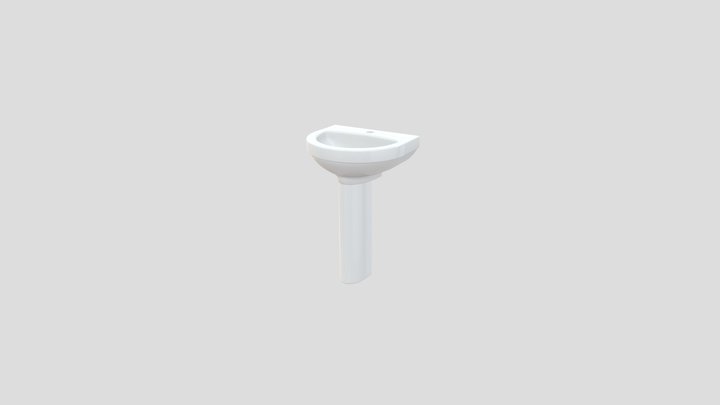
At what (x,y) coordinates should I click in order to perform the action: click on blank spaces corners. Please return your answer as a coordinate pair (x, y). Looking at the image, I should click on (6, 1), (715, 4), (715, 401), (6, 402).